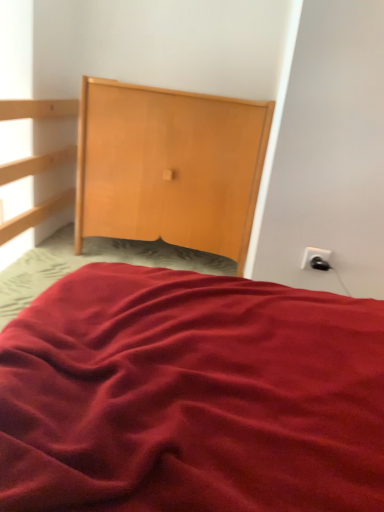
The image size is (384, 512). In order to click on wooden dresser at upper center in this screenshot , I will do `click(169, 166)`.

The height and width of the screenshot is (512, 384). What do you see at coordinates (169, 166) in the screenshot? I see `wooden dresser at upper center` at bounding box center [169, 166].

What is the approximate width of wooden dresser at upper center?

wooden dresser at upper center is 18.08 inches in width.

Locate an element on the screen. white plastic socket at upper right is located at coordinates (x=316, y=259).

Image resolution: width=384 pixels, height=512 pixels. Describe the element at coordinates (316, 259) in the screenshot. I see `white plastic socket at upper right` at that location.

You are a GUI agent. You are given a task and a screenshot of the screen. Output one action in this format:
    pyautogui.click(x=<x>, y=<y>)
    Task: Click on the wooden dresser at upper center
    This screenshot has width=384, height=512.
    Given the screenshot: What is the action you would take?
    pyautogui.click(x=169, y=166)

Looking at this image, is white plastic socket at upper right to the left of wooden dresser at upper center from the viewer's perspective?

In fact, white plastic socket at upper right is to the right of wooden dresser at upper center.

Relative to wooden dresser at upper center, is white plastic socket at upper right in front or behind?

white plastic socket at upper right is positioned closer to the viewer than wooden dresser at upper center.

Between point (312, 258) and point (176, 194), which one is positioned behind?

The point (176, 194) is farther.

From the image's perspective, which one is positioned lower, white plastic socket at upper right or wooden dresser at upper center?

white plastic socket at upper right is shown below in the image.

From a real-world perspective, is white plastic socket at upper right located beneath wooden dresser at upper center?

Yes, from a real-world perspective, white plastic socket at upper right is under wooden dresser at upper center.

Does white plastic socket at upper right have a greater width compared to wooden dresser at upper center?

No, white plastic socket at upper right is not wider than wooden dresser at upper center.

From their relative heights in the image, would you say white plastic socket at upper right is taller or shorter than wooden dresser at upper center?

In the image, white plastic socket at upper right appears to be shorter than wooden dresser at upper center.

Considering the sizes of objects white plastic socket at upper right and wooden dresser at upper center in the image provided, who is bigger, white plastic socket at upper right or wooden dresser at upper center?

wooden dresser at upper center is bigger.

Is wooden dresser at upper center completely or partially inside white plastic socket at upper right?

No, white plastic socket at upper right does not contain wooden dresser at upper center.

Is white plastic socket at upper right far away from wooden dresser at upper center?

Actually, white plastic socket at upper right and wooden dresser at upper center are a little close together.

Is white plastic socket at upper right looking in the opposite direction of wooden dresser at upper center?

Answer: white plastic socket at upper right does not have its back to wooden dresser at upper center.

What's the angular difference between white plastic socket at upper right and wooden dresser at upper center's facing directions?

white plastic socket at upper right and wooden dresser at upper center are facing 0.00532 degrees away from each other.

How distant is white plastic socket at upper right from wooden dresser at upper center?

The distance of white plastic socket at upper right from wooden dresser at upper center is 25.70 inches.

Find the location of a particular element. Image resolution: width=384 pixels, height=512 pixels. electric outlet on the right of wooden dresser at upper center is located at coordinates (316, 259).

Based on their positions, is wooden dresser at upper center located to the left or right of white plastic socket at upper right?

Clearly, wooden dresser at upper center is on the left of white plastic socket at upper right in the image.

Is the position of wooden dresser at upper center less distant than that of white plastic socket at upper right?

No, wooden dresser at upper center is further to the viewer.

Which is behind, point (85, 106) or point (314, 262)?

The point (85, 106) is behind.

From the image's perspective, does wooden dresser at upper center appear higher than white plastic socket at upper right?

Yes, from the image's perspective, wooden dresser at upper center is above white plastic socket at upper right.

From a real-world perspective, which object rests below the other?

white plastic socket at upper right, from a real-world perspective.

In the scene shown: Is wooden dresser at upper center thinner than white plastic socket at upper right?

No.

Considering the sizes of objects wooden dresser at upper center and white plastic socket at upper right in the image provided, who is taller, wooden dresser at upper center or white plastic socket at upper right?

With more height is wooden dresser at upper center.

Is wooden dresser at upper center smaller than white plastic socket at upper right?

Actually, wooden dresser at upper center might be larger than white plastic socket at upper right.

Could white plastic socket at upper right be considered to be inside wooden dresser at upper center?

No, white plastic socket at upper right is located outside of wooden dresser at upper center.

Is wooden dresser at upper center directly adjacent to white plastic socket at upper right?

No, wooden dresser at upper center is not in contact with white plastic socket at upper right.

Is wooden dresser at upper center positioned with its back to white plastic socket at upper right?

No, white plastic socket at upper right is not at the back of wooden dresser at upper center.

Can you tell me how much wooden dresser at upper center and white plastic socket at upper right differ in facing direction?

The angle between the facing direction of wooden dresser at upper center and the facing direction of white plastic socket at upper right is 0.00532 degrees.

The height and width of the screenshot is (512, 384). Identify the location of dresser on the left of white plastic socket at upper right. (169, 166).

Where is `electric outlet located in front of the wooden dresser at upper center`? The width and height of the screenshot is (384, 512). electric outlet located in front of the wooden dresser at upper center is located at coordinates (316, 259).

Locate an element on the screen. This screenshot has width=384, height=512. dresser behind the white plastic socket at upper right is located at coordinates (169, 166).